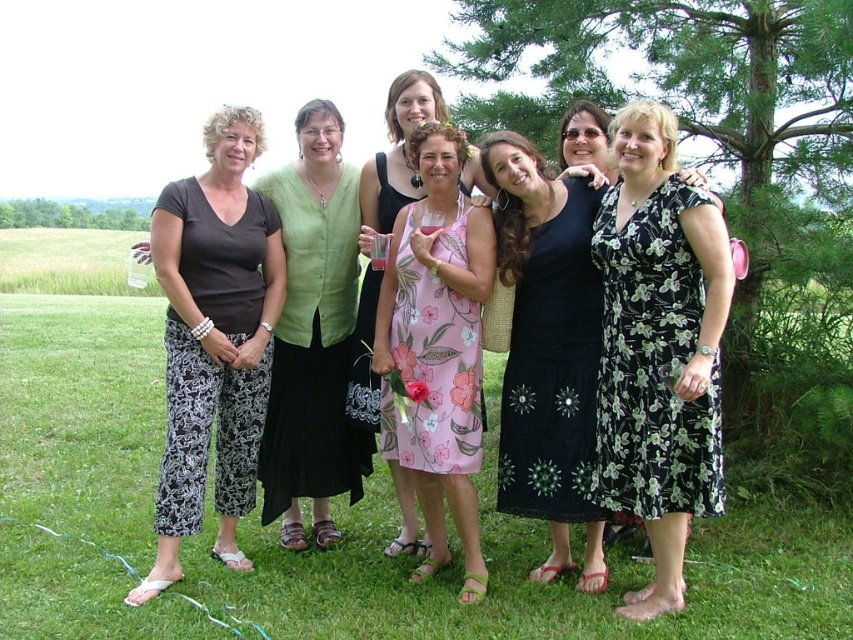
Question: Based on their relative distances, which object is farther from the floral cotton dress at center?

Choices:
 (A) matte green vest at center
 (B) floral-patterned fabric dress at center

Answer: (A)

Question: From the image, what is the correct spatial relationship of floral cotton dress at center in relation to floral-patterned fabric dress at center?

Choices:
 (A) left
 (B) right

Answer: (B)

Question: Is green grass at center wider than floral chiffon dress at center?

Choices:
 (A) no
 (B) yes

Answer: (B)

Question: Which is nearer to the dark gray matte pants at left?

Choices:
 (A) green grass at center
 (B) floral chiffon dress at center

Answer: (B)

Question: Is the position of matte green vest at center more distant than that of floral-patterned fabric dress at center?

Choices:
 (A) yes
 (B) no

Answer: (A)

Question: Which object is farther from the camera taking this photo?

Choices:
 (A) floral chiffon dress at center
 (B) floral print dress at center

Answer: (A)